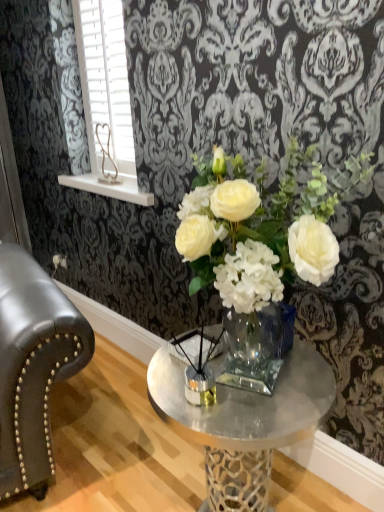
Question: Would you say white plastic blinds at upper left is outside clear glass vase at center?

Choices:
 (A) yes
 (B) no

Answer: (A)

Question: Does white plastic blinds at upper left have a lesser height compared to clear glass vase at center?

Choices:
 (A) yes
 (B) no

Answer: (B)

Question: Does white plastic blinds at upper left have a smaller size compared to clear glass vase at center?

Choices:
 (A) yes
 (B) no

Answer: (A)

Question: Is white plastic blinds at upper left next to clear glass vase at center?

Choices:
 (A) no
 (B) yes

Answer: (A)

Question: Can you confirm if white plastic blinds at upper left is wider than clear glass vase at center?

Choices:
 (A) yes
 (B) no

Answer: (B)

Question: From a real-world perspective, is white plastic blinds at upper left located higher than clear glass vase at center?

Choices:
 (A) no
 (B) yes

Answer: (B)

Question: From the image's perspective, is clear glass vase at center above white plastic blinds at upper left?

Choices:
 (A) yes
 (B) no

Answer: (B)

Question: From a real-world perspective, is clear glass vase at center positioned over white plastic blinds at upper left based on gravity?

Choices:
 (A) yes
 (B) no

Answer: (B)

Question: Is the surface of clear glass vase at center in direct contact with white plastic blinds at upper left?

Choices:
 (A) no
 (B) yes

Answer: (A)

Question: Is clear glass vase at center located outside white plastic blinds at upper left?

Choices:
 (A) no
 (B) yes

Answer: (B)

Question: Is clear glass vase at center shorter than white plastic blinds at upper left?

Choices:
 (A) no
 (B) yes

Answer: (B)

Question: Is clear glass vase at center turned away from white plastic blinds at upper left?

Choices:
 (A) no
 (B) yes

Answer: (A)

Question: From a real-world perspective, is white plastic blinds at upper left above or below clear glass vase at center?

Choices:
 (A) above
 (B) below

Answer: (A)